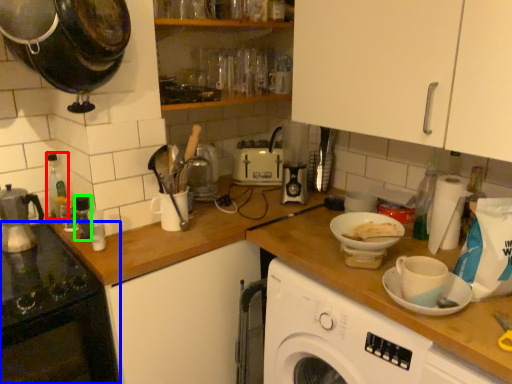
Question: Which object is positioned closest to bottle (highlighted by a red box)? Select from home appliance (highlighted by a blue box) and bottle (highlighted by a green box).

Choices:
 (A) home appliance
 (B) bottle

Answer: (B)